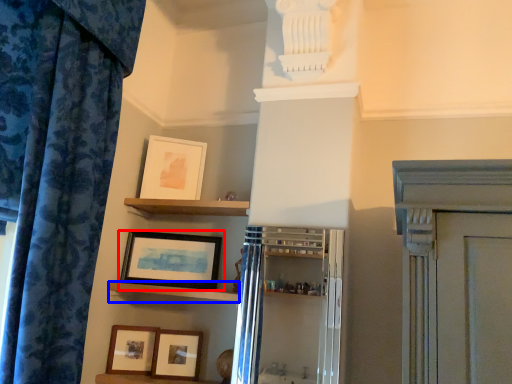
Question: Among these objects, which one is farthest to the camera, picture frame (highlighted by a red box) or shelf (highlighted by a blue box)?

Choices:
 (A) picture frame
 (B) shelf

Answer: (A)